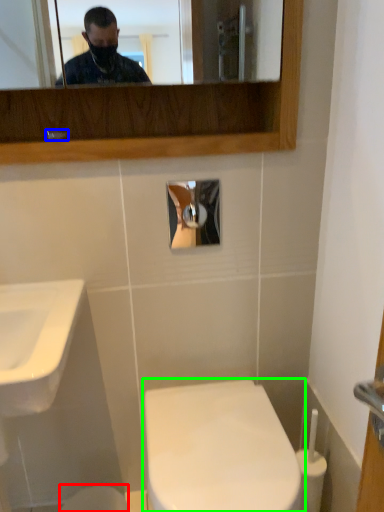
Question: Which object is the farthest from toilet bowl (highlighted by a red box)? Choose among these: faucet (highlighted by a blue box) or toilet (highlighted by a green box).

Choices:
 (A) faucet
 (B) toilet

Answer: (A)